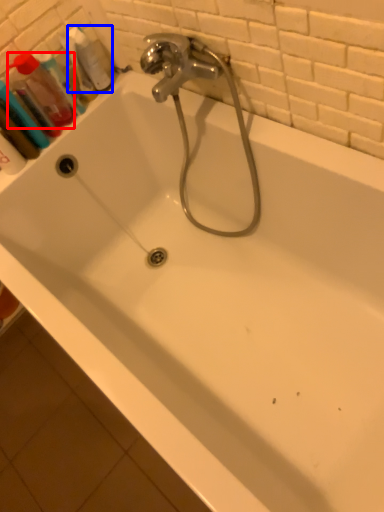
Question: Which object appears closest to the camera in this image, mouthwash (highlighted by a red box) or cleaning product (highlighted by a blue box)?

Choices:
 (A) mouthwash
 (B) cleaning product

Answer: (A)